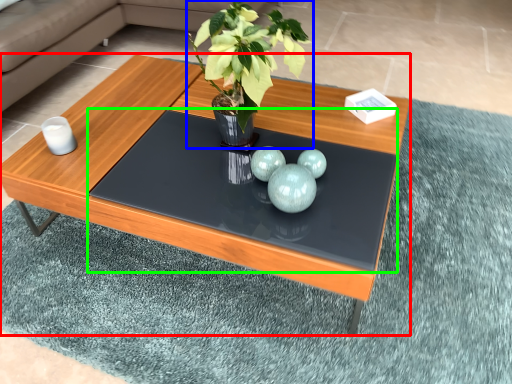
Question: Which object is positioned farthest from coffee table (highlighted by a red box)? Select from houseplant (highlighted by a blue box) and glass table (highlighted by a green box).

Choices:
 (A) houseplant
 (B) glass table

Answer: (A)